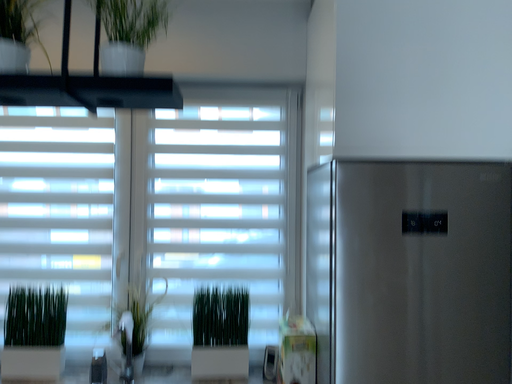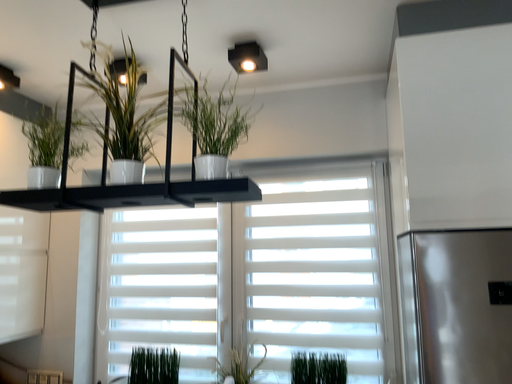
Question: Which way did the camera rotate in the video?

Choices:
 (A) rotated right
 (B) rotated left

Answer: (B)